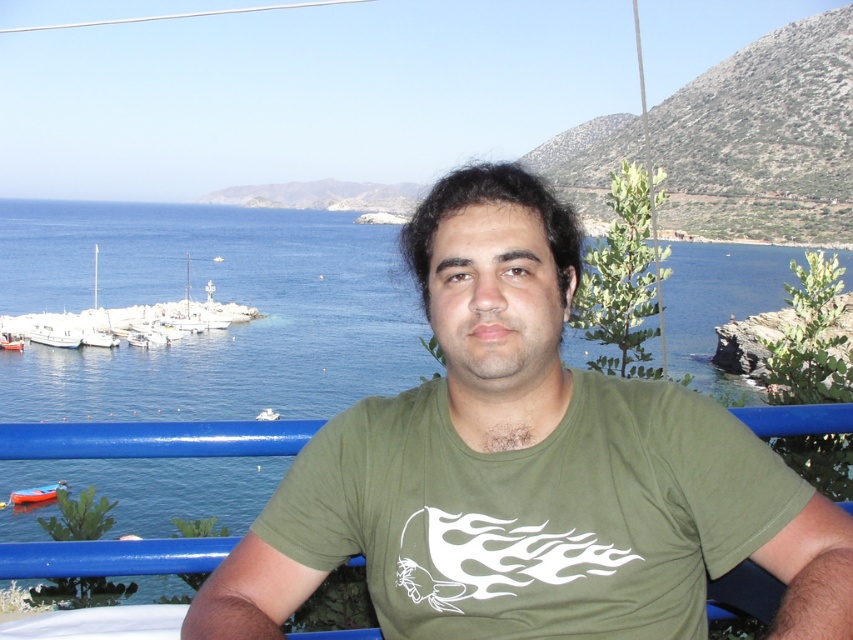
Question: Considering the relative positions of green matte t-shirt at center and orange fiberglass boat at lower left in the image provided, where is green matte t-shirt at center located with respect to orange fiberglass boat at lower left?

Choices:
 (A) below
 (B) above

Answer: (B)

Question: Considering the relative positions of green matte t-shirt at center and white matte boats at left in the image provided, where is green matte t-shirt at center located with respect to white matte boats at left?

Choices:
 (A) above
 (B) below

Answer: (B)

Question: Where is green matte t-shirt at center located in relation to white matte boats at left in the image?

Choices:
 (A) left
 (B) right

Answer: (B)

Question: Which point appears farthest from the camera in this image?

Choices:
 (A) (196, 330)
 (B) (61, 483)
 (C) (640, 428)

Answer: (A)

Question: Considering the real-world distances, which object is farthest from the green matte t-shirt at center?

Choices:
 (A) orange fiberglass boat at lower left
 (B) white matte boats at left

Answer: (B)

Question: Which object is closer to the camera taking this photo?

Choices:
 (A) white matte boats at left
 (B) orange fiberglass boat at lower left

Answer: (B)